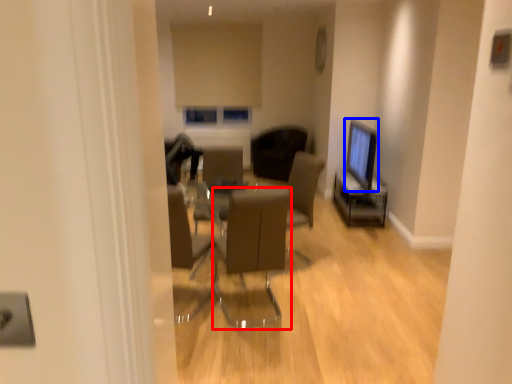
Question: Which object appears closest to the camera in this image, chair (highlighted by a red box) or computer monitor (highlighted by a blue box)?

Choices:
 (A) chair
 (B) computer monitor

Answer: (A)